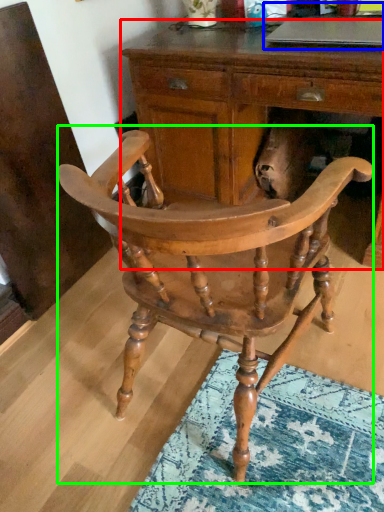
Question: Which object is positioned farthest from desk (highlighted by a red box)? Select from computer (highlighted by a blue box) and chair (highlighted by a green box).

Choices:
 (A) computer
 (B) chair

Answer: (B)